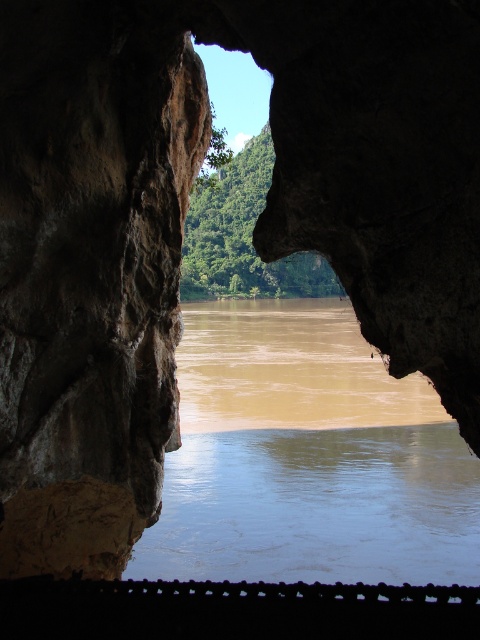
Where is the rough stone wall at left located in the image?

The rough stone wall at left is located at point [91,269] in the image.

You are standing inside the cave and want to exit towards the river. Which direction should you move relative to the rough stone wall at left and the brown muddy water at center?

You should move towards the right side of the rough stone wall at left since it is positioned on the left side of the brown muddy water at center, meaning the opening towards the river is to the right of the wall.